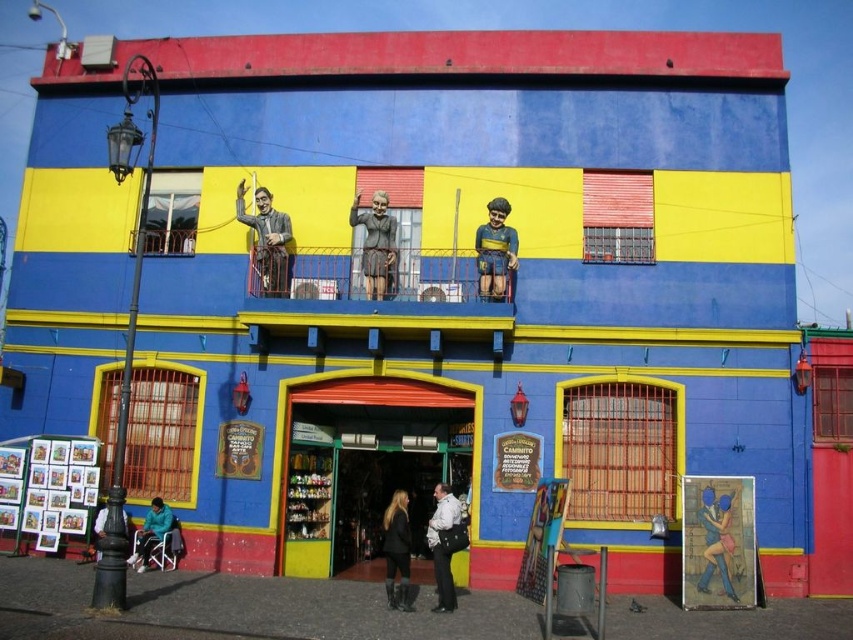
You are a customer standing in front of the shop entrance. You see the blue glossy statue at lower right and the teal fabric jacket at lower left displayed in the shop windows. Which object is positioned higher relative to the other?

The blue glossy statue at lower right is located above the teal fabric jacket at lower left, so it is positioned higher.

Consider the image. You are a customer entering the shop with a red awning and want to ask the salesperson about two items displayed in the windows. The items are the yellow fabric turban at upper center and the matte black jacket at lower left. Which item is closer to the entrance of the shop?

The matte black jacket at lower left is closer to the entrance of the shop because it is positioned at lower left, which is typically near the entrance area, while the yellow fabric turban at upper center is located higher up and further away from the entrance.